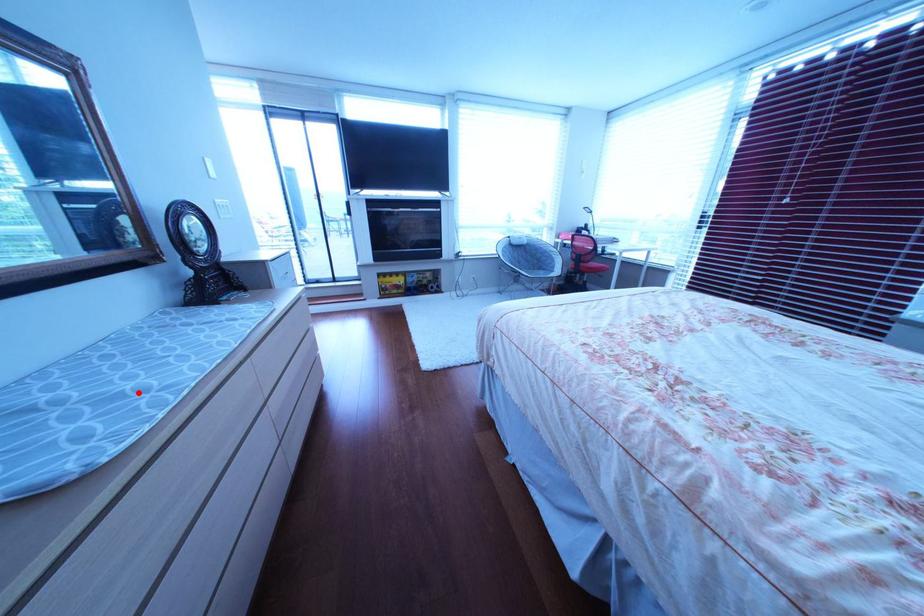
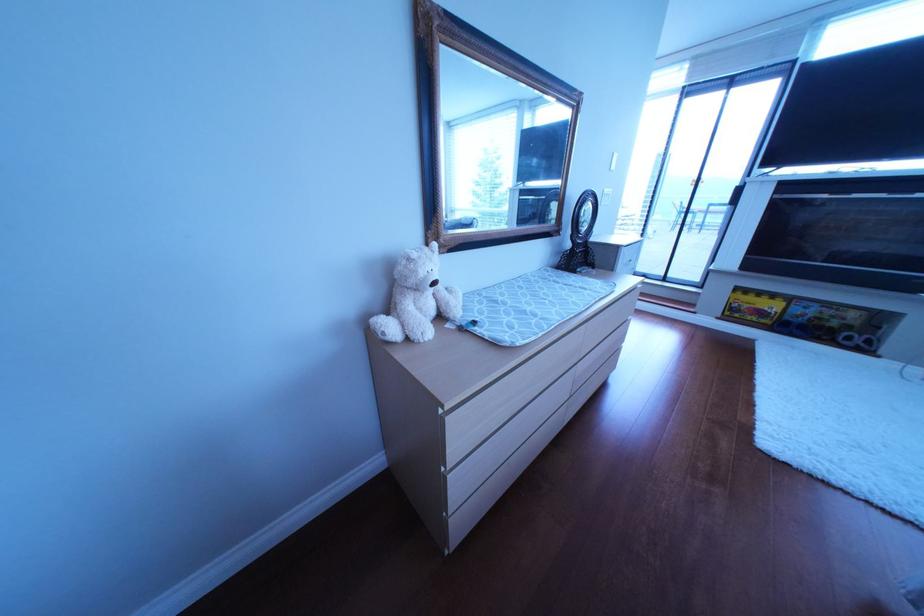
Find the pixel in the second image that matches the highlighted location in the first image.

(541, 312)